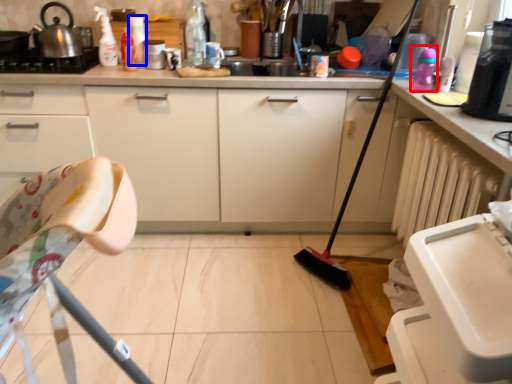
Question: Which object appears closest to the camera in this image, toy (highlighted by a red box) or bottle (highlighted by a blue box)?

Choices:
 (A) toy
 (B) bottle

Answer: (A)